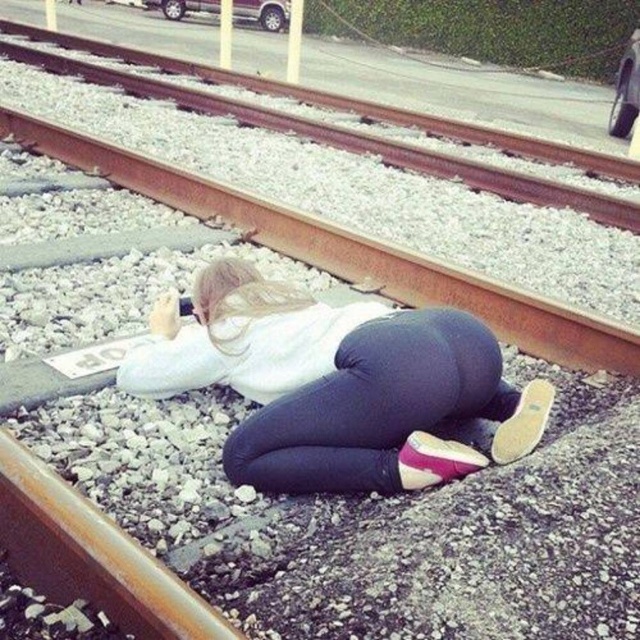
Question: In this image, where is white matte shirt at center located relative to rusty metal train track at center?

Choices:
 (A) right
 (B) left

Answer: (A)

Question: Observing the image, what is the correct spatial positioning of white matte shirt at center in reference to rusty metal train track at center?

Choices:
 (A) right
 (B) left

Answer: (A)

Question: Which of the following is the closest to the observer?

Choices:
 (A) rusty metal train track at center
 (B) white matte shirt at center

Answer: (B)

Question: Does white matte shirt at center come in front of rusty metal train track at center?

Choices:
 (A) yes
 (B) no

Answer: (A)